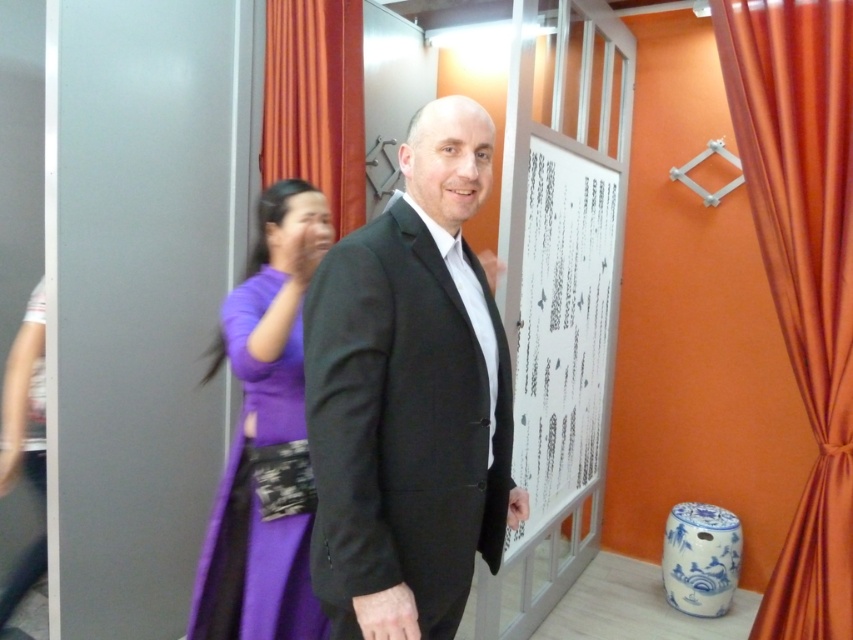
You are organizing a photoshoot and need to ensure that both the black matte suit at center and the purple silk dress at left are clearly visible in the final image. Based on their positions, which one might be partially hidden and require adjustment?

The purple silk dress at left might be partially hidden because the black matte suit at center is positioned in front of it.

You are standing in the room and want to hand a gift to the person wearing the purple silk dress at left. Since you are facing the center of the room, which direction should you turn to approach them?

The purple silk dress at left is located at point (265, 436), which is to the left side of the room. Since you are facing the center, you should turn to your left to approach the person wearing the purple silk dress at left.